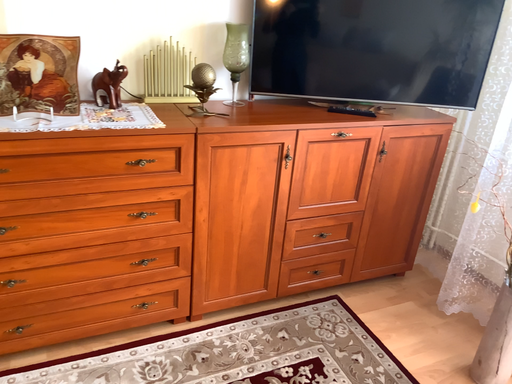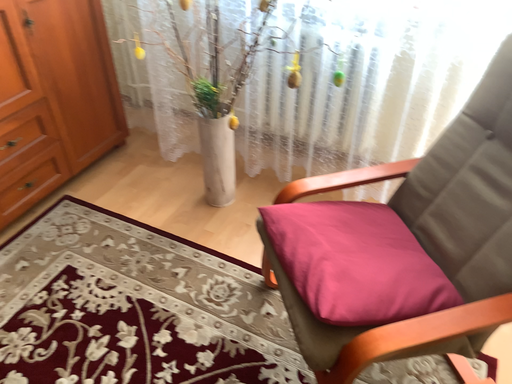
Question: How did the camera likely rotate when shooting the video?

Choices:
 (A) rotated right
 (B) rotated left

Answer: (A)